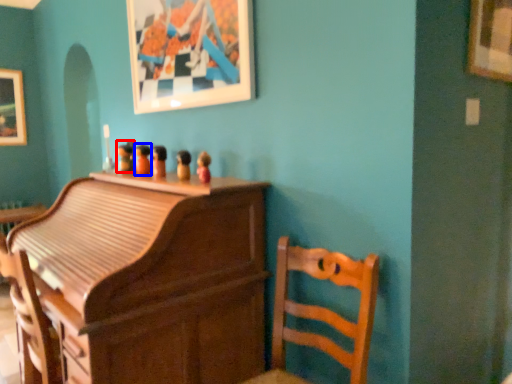
Question: Among these objects, which one is nearest to the camera, toy (highlighted by a red box) or toy (highlighted by a blue box)?

Choices:
 (A) toy
 (B) toy

Answer: (B)